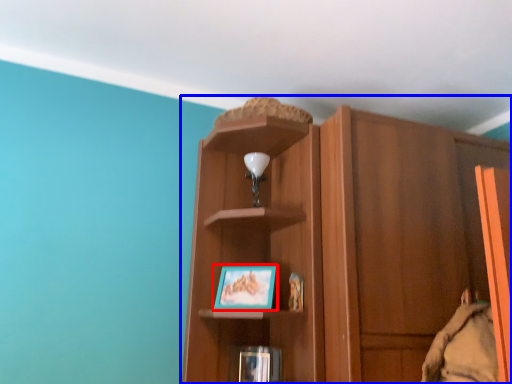
Question: Among these objects, which one is farthest to the camera, picture frame (highlighted by a red box) or cupboard (highlighted by a blue box)?

Choices:
 (A) picture frame
 (B) cupboard

Answer: (A)